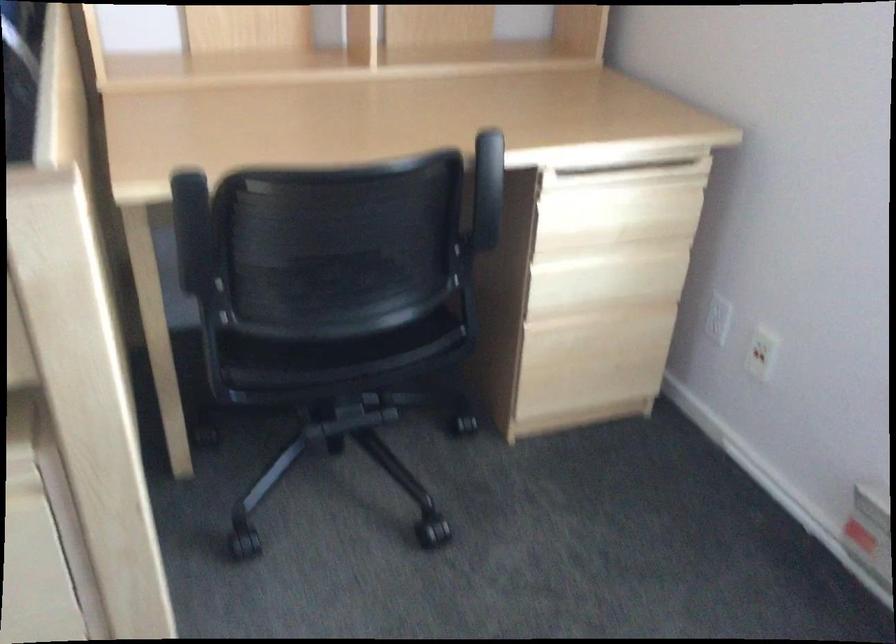
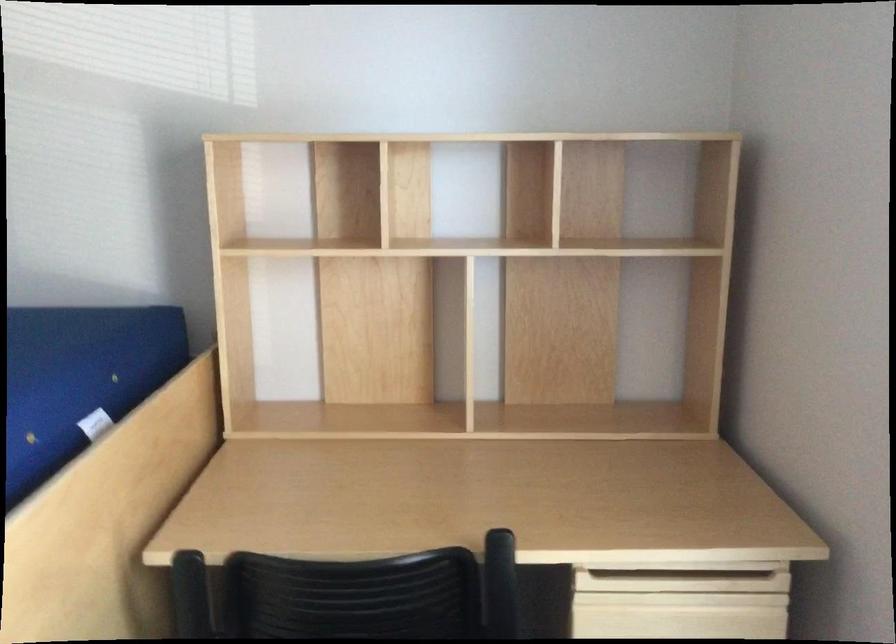
How did the camera likely rotate?

The camera rotated toward left-up.